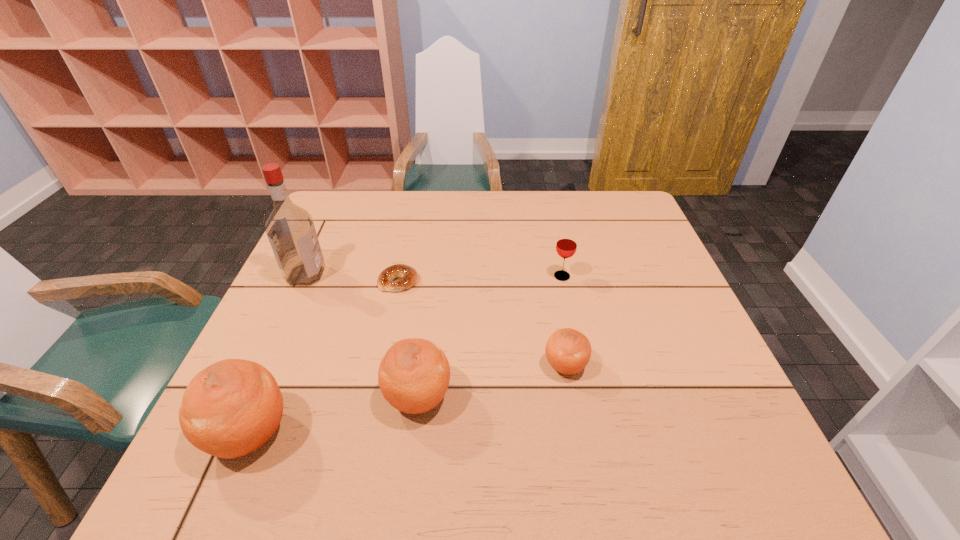
The width and height of the screenshot is (960, 540). What are the coordinates of `the leftmost orange` in the screenshot? It's located at (231, 408).

Locate an element on the screen. the second tallest orange is located at coordinates (414, 374).

Find the location of a particular element. the rightmost orange is located at coordinates (568, 351).

I want to click on the shortest orange, so click(x=568, y=351).

Identify the location of bagel. [407, 276].

The height and width of the screenshot is (540, 960). Identify the location of glass. (566, 245).

The width and height of the screenshot is (960, 540). Identify the location of liquor. coord(290,229).

Locate an element on the screen. The height and width of the screenshot is (540, 960). vacant area located on the right of the leftmost orange is located at coordinates (495, 434).

Find the location of a particular element. The image size is (960, 540). free region located on the back of the second orange from left to right is located at coordinates (432, 285).

This screenshot has height=540, width=960. Find the location of `free space located on the left of the rightmost orange`. free space located on the left of the rightmost orange is located at coordinates (445, 366).